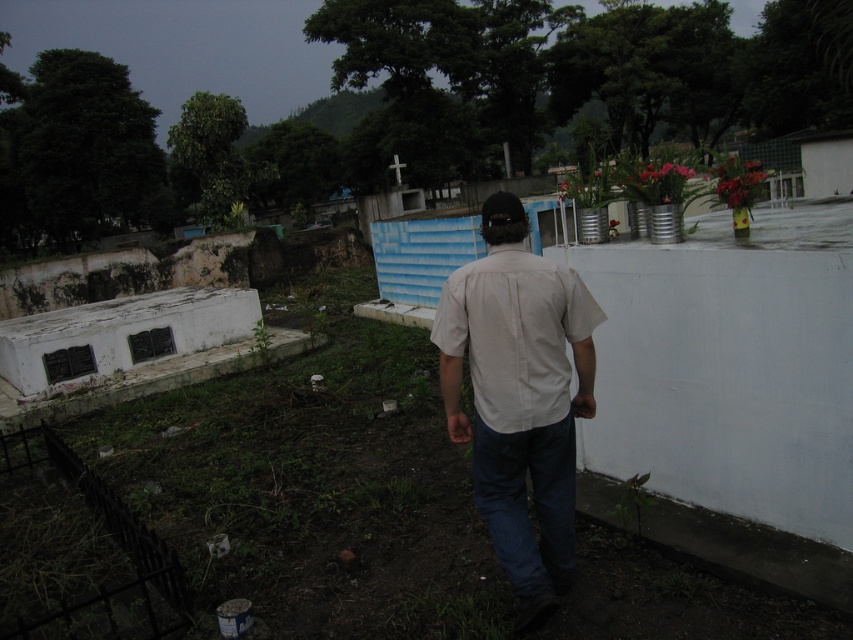
Question: Can you confirm if white matte shirt at center is positioned to the right of denim at lower center?

Choices:
 (A) no
 (B) yes

Answer: (A)

Question: Which object is farther from the camera taking this photo?

Choices:
 (A) white matte shirt at center
 (B) white cotton shirt at center
 (C) denim at lower center

Answer: (C)

Question: Which point is farther to the camera?

Choices:
 (A) (519, 234)
 (B) (567, 436)

Answer: (B)

Question: Can you confirm if white matte shirt at center is positioned above denim at lower center?

Choices:
 (A) no
 (B) yes

Answer: (B)

Question: Is white cotton shirt at center to the right of denim at lower center from the viewer's perspective?

Choices:
 (A) yes
 (B) no

Answer: (B)

Question: Which object appears farthest from the camera in this image?

Choices:
 (A) white matte shirt at center
 (B) denim at lower center

Answer: (B)